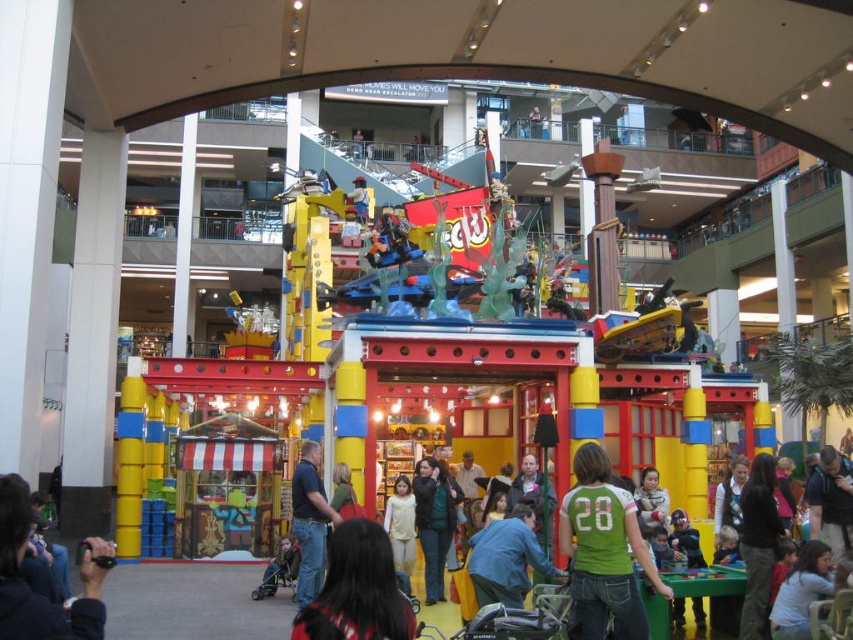
Question: Considering the real-world distances, which object is closest to the dark gray hoodie at lower left?

Choices:
 (A) light blue shirt at lower right
 (B) green jersey at center

Answer: (B)

Question: Which point appears closest to the camera in this image?

Choices:
 (A) (405, 545)
 (B) (9, 634)
 (C) (770, 547)

Answer: (B)

Question: Does green jersey at center have a lesser width compared to light blue shirt at lower right?

Choices:
 (A) no
 (B) yes

Answer: (A)

Question: Which object appears farthest from the camera in this image?

Choices:
 (A) dark brown hair at lower center
 (B) dark gray pants at center

Answer: (B)

Question: Does green matte jacket at center come in front of matte pink shirt at lower right?

Choices:
 (A) no
 (B) yes

Answer: (A)

Question: Can you confirm if blue denim jeans at center is bigger than matte pink shirt at lower right?

Choices:
 (A) yes
 (B) no

Answer: (A)